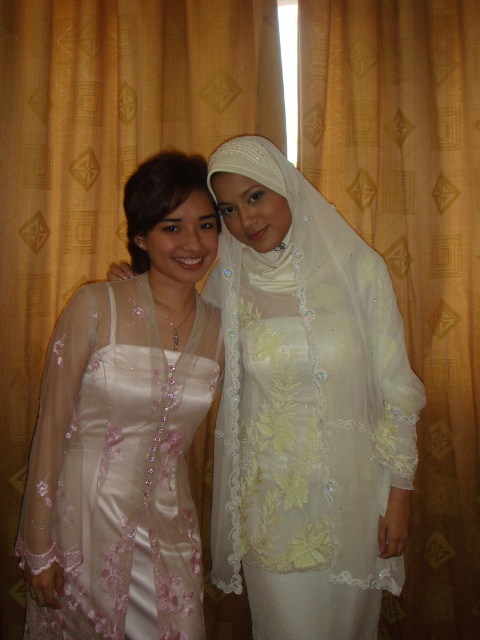
You are a photographer setting up a shoot in this scene. You need to position a spotlight exactly at the location of the satin white dress at center. What are the coordinates where you should place the spotlight?

The coordinates for the satin white dress at center are at point [305,404], so you should place the spotlight there.